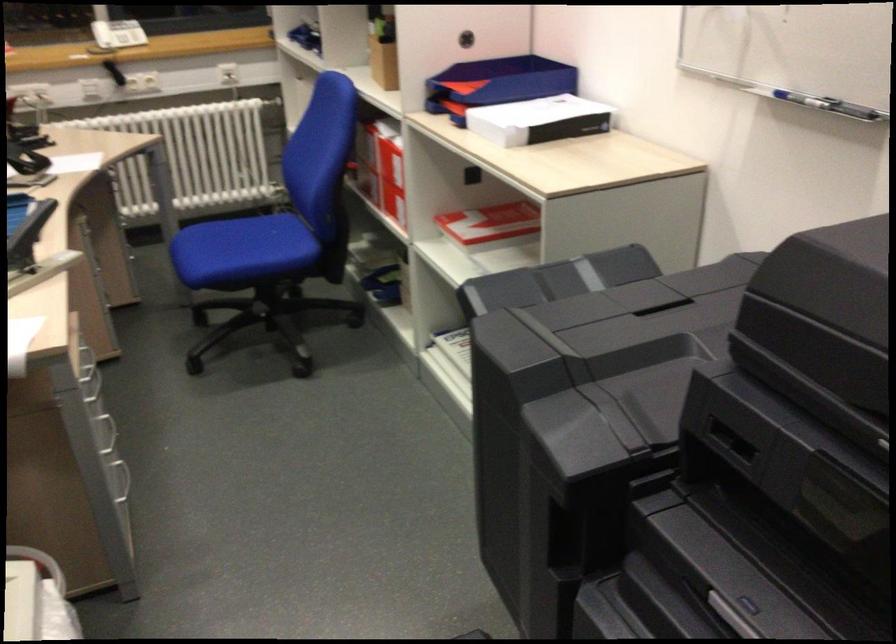
The image size is (896, 644). What are the coordinates of `red and white box` in the screenshot? It's located at (489, 223).